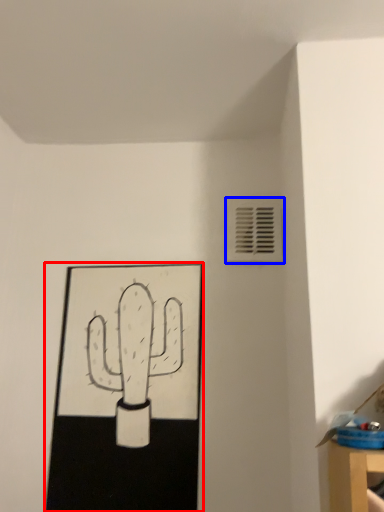
Question: Among these objects, which one is farthest to the camera, picture frame (highlighted by a red box) or air conditioning (highlighted by a blue box)?

Choices:
 (A) picture frame
 (B) air conditioning

Answer: (B)